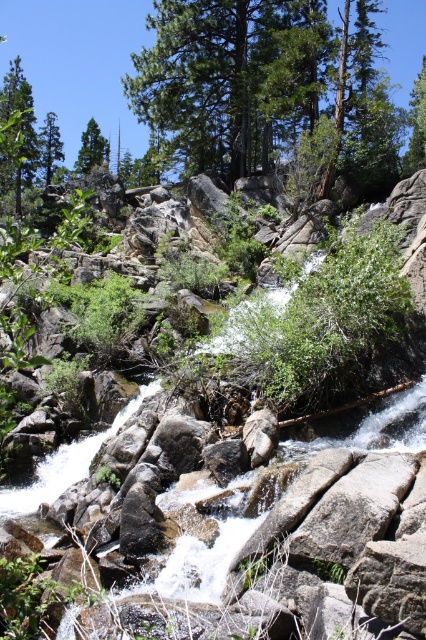
Is point (2, 138) farther from camera compared to point (40, 144)?

No, it is not.

Which is behind, point (29, 157) or point (48, 161)?

The point (48, 161) is behind.

You are a GUI agent. You are given a task and a screenshot of the screen. Output one action in this format:
    pyautogui.click(x=<x>, y=<y>)
    Task: Click on the green leafy tree at left
    The height and width of the screenshot is (640, 426).
    Given the screenshot: What is the action you would take?
    pyautogui.click(x=17, y=132)

Who is positioned more to the right, green matte tree at upper right or green matte tree at upper left?

From the viewer's perspective, green matte tree at upper right appears more on the right side.

Can you confirm if green matte tree at upper right is positioned above green matte tree at upper left?

No, green matte tree at upper right is not above green matte tree at upper left.

Which is in front, point (412, 109) or point (54, 160)?

Positioned in front is point (412, 109).

Locate an element on the screen. Image resolution: width=426 pixels, height=640 pixels. green matte tree at upper right is located at coordinates (417, 125).

Is point (422, 122) positioned in front of point (88, 138)?

Yes, it is.

Does green matte tree at upper right have a larger size compared to green matte tree at upper center?

No, green matte tree at upper right is not bigger than green matte tree at upper center.

Is point (405, 163) behind point (88, 170)?

That is False.

This screenshot has height=640, width=426. I want to click on green matte tree at upper right, so click(x=417, y=125).